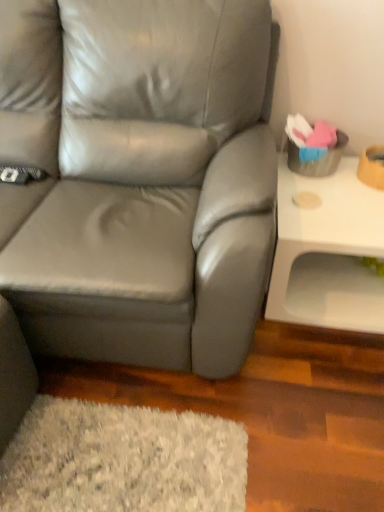
The width and height of the screenshot is (384, 512). What do you see at coordinates (144, 185) in the screenshot? I see `matte gray leather couch at center` at bounding box center [144, 185].

The image size is (384, 512). Identify the location of matte gray leather couch at center. (144, 185).

What do you see at coordinates (327, 252) in the screenshot?
I see `white glossy table at right` at bounding box center [327, 252].

Identify the location of white glossy table at right. This screenshot has width=384, height=512. (327, 252).

What is the approximate height of white glossy table at right?

white glossy table at right is 15.27 inches in height.

Where is `matte gray leather couch at center`? matte gray leather couch at center is located at coordinates (144, 185).

Considering the relative positions of matte gray leather couch at center and white glossy table at right in the image provided, is matte gray leather couch at center to the left of white glossy table at right from the viewer's perspective?

Correct, you'll find matte gray leather couch at center to the left of white glossy table at right.

Which object is further away from the camera, matte gray leather couch at center or white glossy table at right?

white glossy table at right is more distant.

Is point (234, 226) positioned before point (308, 309)?

Yes, it is.

From the image's perspective, which one is positioned higher, matte gray leather couch at center or white glossy table at right?

matte gray leather couch at center.

From a real-world perspective, is matte gray leather couch at center under white glossy table at right?

No, from a real-world perspective, matte gray leather couch at center is not beneath white glossy table at right.

Can you confirm if matte gray leather couch at center is thinner than white glossy table at right?

No, matte gray leather couch at center is not thinner than white glossy table at right.

Who is shorter, matte gray leather couch at center or white glossy table at right?

white glossy table at right is shorter.

Considering the sizes of objects matte gray leather couch at center and white glossy table at right in the image provided, who is smaller, matte gray leather couch at center or white glossy table at right?

white glossy table at right.

Is matte gray leather couch at center surrounding white glossy table at right?

No, white glossy table at right is not surrounded by matte gray leather couch at center.

Is matte gray leather couch at center next to white glossy table at right?

No, matte gray leather couch at center is not in contact with white glossy table at right.

Does matte gray leather couch at center turn towards white glossy table at right?

No, matte gray leather couch at center is not facing towards white glossy table at right.

How many degrees apart are the facing directions of matte gray leather couch at center and white glossy table at right?

0.000224 degrees separate the facing orientations of matte gray leather couch at center and white glossy table at right.

The image size is (384, 512). I want to click on studio couch located above the white glossy table at right (from the image's perspective), so 144,185.

Between white glossy table at right and matte gray leather couch at center, which one appears on the right side from the viewer's perspective?

From the viewer's perspective, white glossy table at right appears more on the right side.

Which object is more forward, white glossy table at right or matte gray leather couch at center?

matte gray leather couch at center is closer to the camera.

Which is behind, point (377, 290) or point (231, 305)?

Positioned behind is point (377, 290).

From the image's perspective, who appears lower, white glossy table at right or matte gray leather couch at center?

white glossy table at right, from the image's perspective.

From a real-world perspective, is white glossy table at right above or below matte gray leather couch at center?

Clearly, from a real-world perspective, white glossy table at right is below matte gray leather couch at center.

Is white glossy table at right thinner than matte gray leather couch at center?

Indeed, white glossy table at right has a lesser width compared to matte gray leather couch at center.

Which of these two, white glossy table at right or matte gray leather couch at center, stands taller?

matte gray leather couch at center is taller.

Considering the sizes of objects white glossy table at right and matte gray leather couch at center in the image provided, who is smaller, white glossy table at right or matte gray leather couch at center?

white glossy table at right.

In the scene shown: Would you say white glossy table at right is outside matte gray leather couch at center?

white glossy table at right is positioned outside matte gray leather couch at center.

Is white glossy table at right far away from matte gray leather couch at center?

No, white glossy table at right is not far away from matte gray leather couch at center.

Is white glossy table at right oriented away from matte gray leather couch at center?

No.

Measure the distance between white glossy table at right and matte gray leather couch at center.

white glossy table at right and matte gray leather couch at center are 19.87 inches apart from each other.

Image resolution: width=384 pixels, height=512 pixels. Find the location of `studio couch in front of the white glossy table at right`. studio couch in front of the white glossy table at right is located at coordinates (144, 185).

Locate an element on the screen. The width and height of the screenshot is (384, 512). studio couch on the left of white glossy table at right is located at coordinates [144, 185].

Identify the location of studio couch above the white glossy table at right (from the image's perspective). This screenshot has height=512, width=384. (144, 185).